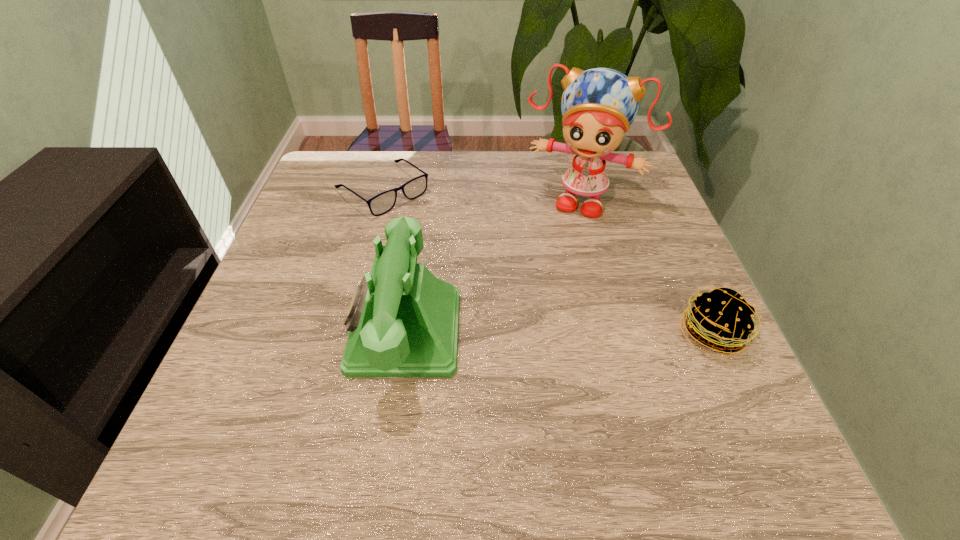
Identify the location of object at the far right corner. coord(599,105).

Locate an element on the screen. free region at the far edge of the desktop is located at coordinates (552, 174).

Identify the location of vacant area at the near edge of the desktop. (599, 401).

This screenshot has height=540, width=960. Identify the location of free spot at the left edge of the desktop. (286, 364).

Locate an element on the screen. The height and width of the screenshot is (540, 960). vacant space at the right edge of the desktop is located at coordinates (615, 248).

Identify the location of free space at the far left corner of the desktop. (330, 165).

Identify the location of free area in between the patty and the doll. This screenshot has height=540, width=960. (646, 266).

Identify the location of free spot between the doll and the spectacles. This screenshot has width=960, height=540. (482, 194).

This screenshot has height=540, width=960. Find the location of `empty space between the third tallest object and the shortest object`. empty space between the third tallest object and the shortest object is located at coordinates (547, 262).

Locate an element on the screen. The height and width of the screenshot is (540, 960). unoccupied area between the second shortest object and the shortest object is located at coordinates pos(547,262).